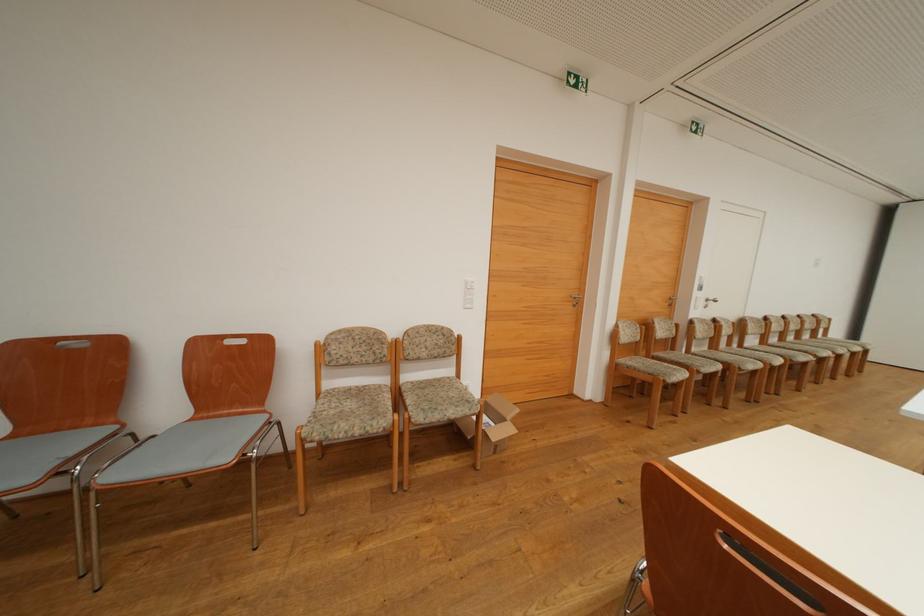
Where is `white light switch`? white light switch is located at coordinates (470, 283).